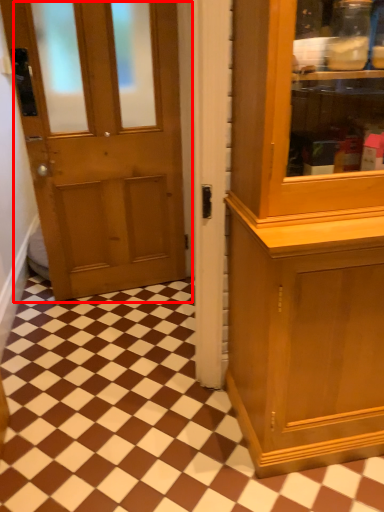
Question: In this image, where is door (annotated by the red box) located relative to tile?

Choices:
 (A) right
 (B) left

Answer: (B)